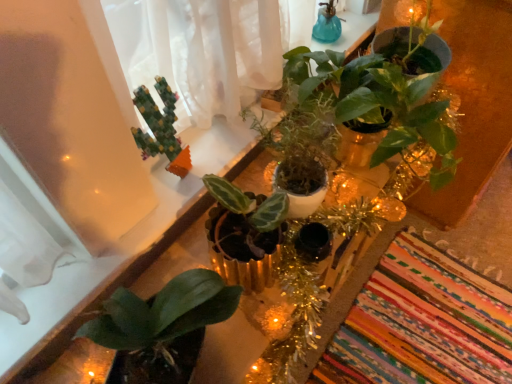
This screenshot has height=384, width=512. I want to click on vacant region in front of green mosaic cactus at upper left, placed as the first houseplant when sorted from left to right, so click(x=150, y=213).